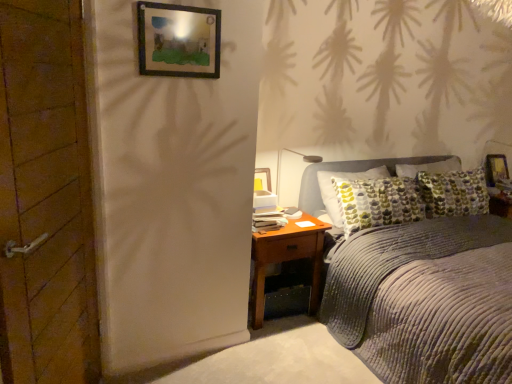
The height and width of the screenshot is (384, 512). Describe the element at coordinates (287, 259) in the screenshot. I see `brown wooden nightstand at lower right` at that location.

Describe the element at coordinates (46, 198) in the screenshot. This screenshot has height=384, width=512. I see `wooden door at left` at that location.

Measure the distance between point (487,178) and camera.

They are 3.92 meters apart.

Measure the distance between point (417, 225) and camera.

The distance of point (417, 225) from camera is 2.95 meters.

The width and height of the screenshot is (512, 384). What do you see at coordinates (296, 154) in the screenshot? I see `white plastic lamp at center` at bounding box center [296, 154].

How much space does wooden framed picture at upper center, which is the 2th picture frame in bottom-to-top order, occupy horizontally?

wooden framed picture at upper center, which is the 2th picture frame in bottom-to-top order, is 3.76 centimeters in width.

This screenshot has height=384, width=512. I want to click on brown wooden nightstand at lower right, so click(287, 259).

Considering the relative sizes of corduroy gray bed at center and white plastic lamp at center in the image provided, is corduroy gray bed at center thinner than white plastic lamp at center?

In fact, corduroy gray bed at center might be wider than white plastic lamp at center.

Based on the photo, between corduroy gray bed at center and white plastic lamp at center, which one has larger size?

corduroy gray bed at center is bigger.

Which is behind, corduroy gray bed at center or white plastic lamp at center?

Positioned behind is white plastic lamp at center.

From the image's perspective, is wooden door at left located beneath brown wooden nightstand at lower right?

No, from the image's perspective, wooden door at left is not beneath brown wooden nightstand at lower right.

Is wooden door at left in front of brown wooden nightstand at lower right?

That is True.

Find the location of a particular element. This screenshot has width=512, height=384. door above the brown wooden nightstand at lower right (from a real-world perspective) is located at coordinates (46, 198).

Between wooden door at left and brown wooden nightstand at lower right, which one appears on the left side from the viewer's perspective?

Positioned to the left is wooden door at left.

At what (x,y) coordinates should I click in order to perform the action: click on picture frame that is the 2nd one above the brown wooden nightstand at lower right (from a real-world perspective). Please return your answer as a coordinate pair (x, y). The image size is (512, 384). Looking at the image, I should click on (178, 40).

Is brown wooden nightstand at lower right at the left side of wooden framed picture at upper center, arranged as the first picture frame when viewed from the top?

No, brown wooden nightstand at lower right is not to the left of wooden framed picture at upper center, arranged as the first picture frame when viewed from the top.

From the image's perspective, which one is positioned higher, brown wooden nightstand at lower right or wooden framed picture at upper center, which is counted as the second picture frame, starting from the back?

wooden framed picture at upper center, which is counted as the second picture frame, starting from the back, from the image's perspective.

Between brown wooden nightstand at lower right and wooden framed picture at upper center, which is counted as the second picture frame, starting from the back, which one has larger width?

brown wooden nightstand at lower right is wider.

The width and height of the screenshot is (512, 384). In order to click on light fixture below the wooden picture frame at upper right, the first picture frame positioned from the right (from the image's perspective) in this screenshot , I will do `click(296, 154)`.

What's the angular difference between wooden picture frame at upper right, acting as the second picture frame starting from the top, and white plastic lamp at center's facing directions?

There is a 0.488-degree angle between the facing directions of wooden picture frame at upper right, acting as the second picture frame starting from the top, and white plastic lamp at center.

From a real-world perspective, which object stands above the other?

From a 3D spatial view, white plastic lamp at center is above.

Which object is positioned more to the left, wooden picture frame at upper right, the first picture frame positioned from the right, or white plastic lamp at center?

Positioned to the left is white plastic lamp at center.

Looking at this image, considering the sizes of objects white plastic lamp at center and corduroy gray bed at center in the image provided, who is wider, white plastic lamp at center or corduroy gray bed at center?

corduroy gray bed at center is wider.

Is white plastic lamp at center oriented away from corduroy gray bed at center?

Yes, white plastic lamp at center's orientation is away from corduroy gray bed at center.

From a real-world perspective, is white plastic lamp at center over corduroy gray bed at center?

Yes, from a real-world perspective, white plastic lamp at center is on top of corduroy gray bed at center.

Considering the sizes of objects white plastic lamp at center and wooden door at left in the image provided, who is thinner, white plastic lamp at center or wooden door at left?

wooden door at left.

Is white plastic lamp at center oriented towards wooden door at left?

No, white plastic lamp at center does not turn towards wooden door at left.

Looking at this image, from the image's perspective, which one is positioned higher, white plastic lamp at center or wooden door at left?

white plastic lamp at center is shown above in the image.

Considering the positions of objects white plastic lamp at center and wooden door at left in the image provided, who is more to the right, white plastic lamp at center or wooden door at left?

From the viewer's perspective, white plastic lamp at center appears more on the right side.

Between wooden picture frame at upper right, the first picture frame positioned from the right, and brown wooden nightstand at lower right, which one appears on the right side from the viewer's perspective?

wooden picture frame at upper right, the first picture frame positioned from the right, is more to the right.

Is point (489, 179) behind point (267, 263)?

Yes, point (489, 179) is behind point (267, 263).

Considering the relative sizes of wooden picture frame at upper right, which ranks as the 2th picture frame in front-to-back order, and brown wooden nightstand at lower right in the image provided, is wooden picture frame at upper right, which ranks as the 2th picture frame in front-to-back order, bigger than brown wooden nightstand at lower right?

No, wooden picture frame at upper right, which ranks as the 2th picture frame in front-to-back order, is not bigger than brown wooden nightstand at lower right.

Considering the relative sizes of wooden picture frame at upper right, placed as the 1th picture frame when sorted from back to front, and brown wooden nightstand at lower right in the image provided, is wooden picture frame at upper right, placed as the 1th picture frame when sorted from back to front, shorter than brown wooden nightstand at lower right?

Yes.

This screenshot has width=512, height=384. I want to click on light fixture above the corduroy gray bed at center (from a real-world perspective), so (x=296, y=154).

You are a GUI agent. You are given a task and a screenshot of the screen. Output one action in this format:
    pyautogui.click(x=<x>, y=<y>)
    Task: Click on the door that is above the brown wooden nightstand at lower right (from the image's perspective)
    This screenshot has width=512, height=384.
    Given the screenshot: What is the action you would take?
    pyautogui.click(x=46, y=198)

From the image, which object appears to be nearer to wooden framed picture at upper center, positioned as the 2th picture frame in right-to-left order, corduroy gray bed at center or white plastic lamp at center?

white plastic lamp at center is closer to wooden framed picture at upper center, positioned as the 2th picture frame in right-to-left order.

Estimate the real-world distances between objects in this image. Which object is further from white plastic lamp at center, wooden framed picture at upper center, positioned as the 2th picture frame in right-to-left order, or wooden door at left?

wooden door at left is positioned further to the anchor white plastic lamp at center.

When comparing their distances from wooden framed picture at upper center, which ranks as the first picture frame in front-to-back order, does white plastic lamp at center or wooden door at left seem closer?

wooden door at left is closer to wooden framed picture at upper center, which ranks as the first picture frame in front-to-back order.

Which object lies further to the anchor point wooden framed picture at upper center, which is counted as the second picture frame, starting from the back, brown wooden nightstand at lower right or corduroy gray bed at center?

corduroy gray bed at center lies further to wooden framed picture at upper center, which is counted as the second picture frame, starting from the back, than the other object.

Considering their positions, is wooden door at left positioned closer to wooden picture frame at upper right, the first picture frame positioned from the right, than corduroy gray bed at center?

The object closer to wooden picture frame at upper right, the first picture frame positioned from the right, is corduroy gray bed at center.

Looking at the image, which one is located closer to wooden framed picture at upper center, which is the 2th picture frame in bottom-to-top order, white plastic lamp at center or brown wooden nightstand at lower right?

Among the two, brown wooden nightstand at lower right is located nearer to wooden framed picture at upper center, which is the 2th picture frame in bottom-to-top order.

Based on their spatial positions, is corduroy gray bed at center or wooden door at left further from brown wooden nightstand at lower right?

wooden door at left lies further to brown wooden nightstand at lower right than the other object.

Based on their spatial positions, is white plastic lamp at center or corduroy gray bed at center further from wooden framed picture at upper center, which ranks as the first picture frame in front-to-back order?

corduroy gray bed at center lies further to wooden framed picture at upper center, which ranks as the first picture frame in front-to-back order, than the other object.

Identify the location of light fixture between wooden door at left and corduroy gray bed at center in the horizontal direction. (296, 154).

This screenshot has width=512, height=384. I want to click on nightstand between corduroy gray bed at center and wooden picture frame at upper right, placed as the 1th picture frame when sorted from back to front, in the front-back direction, so click(287, 259).

The width and height of the screenshot is (512, 384). Find the location of `light fixture between wooden framed picture at upper center, which is counted as the second picture frame, starting from the back, and wooden picture frame at upper right, the first picture frame positioned from the right, in the horizontal direction`. light fixture between wooden framed picture at upper center, which is counted as the second picture frame, starting from the back, and wooden picture frame at upper right, the first picture frame positioned from the right, in the horizontal direction is located at coordinates (296, 154).

Image resolution: width=512 pixels, height=384 pixels. What are the coordinates of `nightstand between wooden framed picture at upper center, the 1th picture frame from the left, and corduroy gray bed at center from left to right` in the screenshot? It's located at (287, 259).